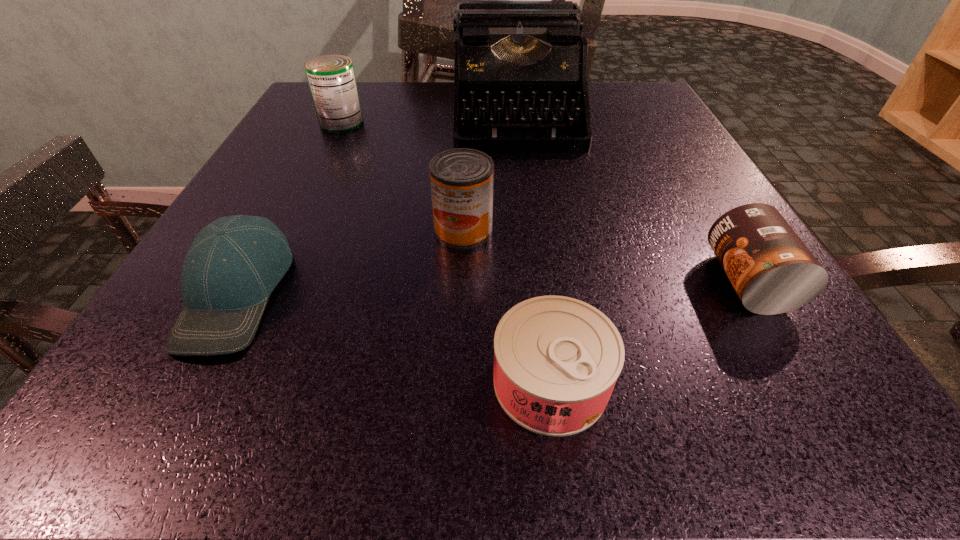
Find the location of a particular element. This screenshot has height=540, width=960. the second closest can to the third tallest can is located at coordinates (461, 179).

Find the location of `the second closest can to the baseball cap`. the second closest can to the baseball cap is located at coordinates (556, 359).

You are a GUI agent. You are given a task and a screenshot of the screen. Output one action in this format:
    pyautogui.click(x=<x>, y=<y>)
    Task: Click on the free point that satisfies the following two spatial constraints: 1. on the front side of the nearest can; 2. on the left side of the third nearest can
    Image resolution: width=960 pixels, height=540 pixels.
    Given the screenshot: What is the action you would take?
    pyautogui.click(x=457, y=381)

At what (x,y) coordinates should I click in order to perform the action: click on blank area in the image that satisfies the following two spatial constraints: 1. on the typing side of the nearest can; 2. on the right side of the tallest object. Please return your answer as a coordinate pair (x, y). This screenshot has height=540, width=960. Looking at the image, I should click on (549, 381).

Where is `vacant space that satisfies the following two spatial constraints: 1. on the typing side of the shortest can; 2. on the left side of the tallest object`? The width and height of the screenshot is (960, 540). vacant space that satisfies the following two spatial constraints: 1. on the typing side of the shortest can; 2. on the left side of the tallest object is located at coordinates (549, 381).